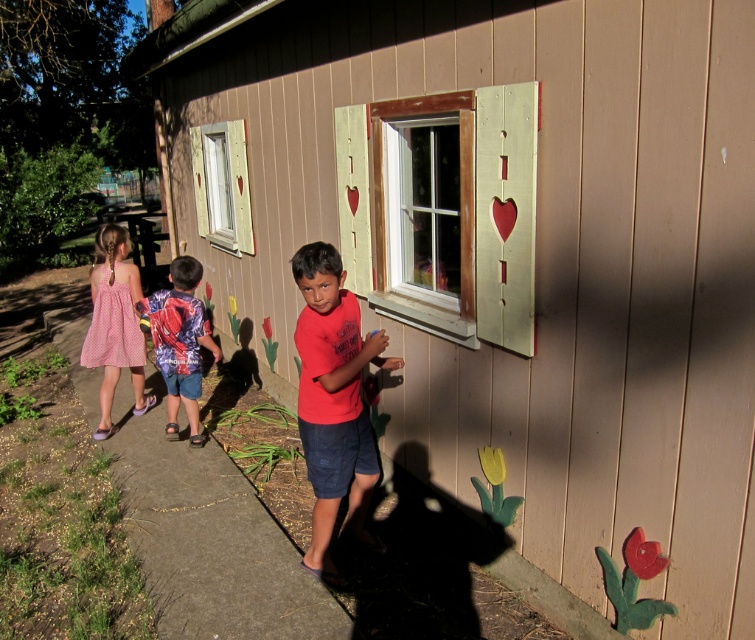
Consider the image. Which of these two, pink dotted dress at left or white painted wood window at upper left, stands taller?

pink dotted dress at left

Can you confirm if pink dotted dress at left is positioned to the left of white painted wood window at upper left?

Indeed, pink dotted dress at left is positioned on the left side of white painted wood window at upper left.

This screenshot has width=755, height=640. I want to click on pink dotted dress at left, so click(113, 324).

Can you confirm if blue printed shirt at center is positioned to the right of white painted wood window at upper left?

Correct, you'll find blue printed shirt at center to the right of white painted wood window at upper left.

Between point (199, 321) and point (245, 131), which one is positioned behind?

The point (245, 131) is behind.

Is point (188, 260) closer to viewer compared to point (230, 160)?

Yes.

Where is `blue printed shirt at center`? blue printed shirt at center is located at coordinates (179, 340).

Which is below, white wooden window at center or blue printed shirt at center?

blue printed shirt at center is below.

Is white wooden window at center to the right of blue printed shirt at center from the viewer's perspective?

Indeed, white wooden window at center is positioned on the right side of blue printed shirt at center.

Image resolution: width=755 pixels, height=640 pixels. What do you see at coordinates (424, 209) in the screenshot?
I see `white wooden window at center` at bounding box center [424, 209].

In order to click on white wooden window at center in this screenshot , I will do `click(424, 209)`.